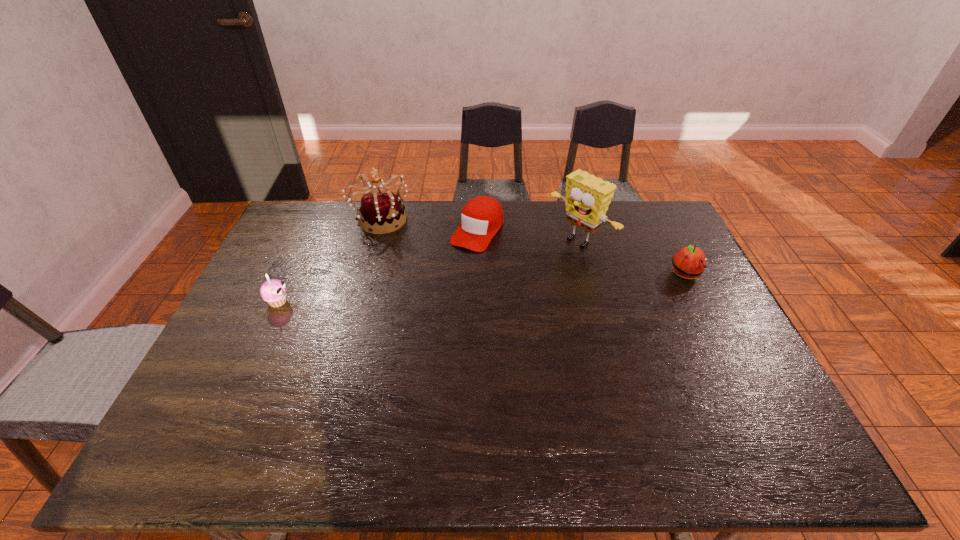
The image size is (960, 540). Find the location of `cupcake`. cupcake is located at coordinates (273, 291).

At what (x,y) coordinates should I click in order to perform the action: click on the nearest object. Please return your answer as a coordinate pair (x, y). The width and height of the screenshot is (960, 540). Looking at the image, I should click on (273, 291).

The width and height of the screenshot is (960, 540). In order to click on the rightmost object in this screenshot , I will do `click(689, 262)`.

I want to click on the fourth farthest object, so click(x=689, y=262).

Locate an element on the screen. The width and height of the screenshot is (960, 540). sponge is located at coordinates (587, 199).

Locate an element on the screen. baseball cap is located at coordinates (482, 217).

In order to click on tiara in this screenshot , I will do `click(382, 211)`.

Where is `blank space located 0.250m on the face of the nearest object`? Image resolution: width=960 pixels, height=540 pixels. blank space located 0.250m on the face of the nearest object is located at coordinates (373, 302).

Where is `vacant position located 0.100m on the left of the fourth farthest object`? Image resolution: width=960 pixels, height=540 pixels. vacant position located 0.100m on the left of the fourth farthest object is located at coordinates (637, 275).

In order to click on free location located on the front-facing side of the sponge in this screenshot , I will do `click(524, 280)`.